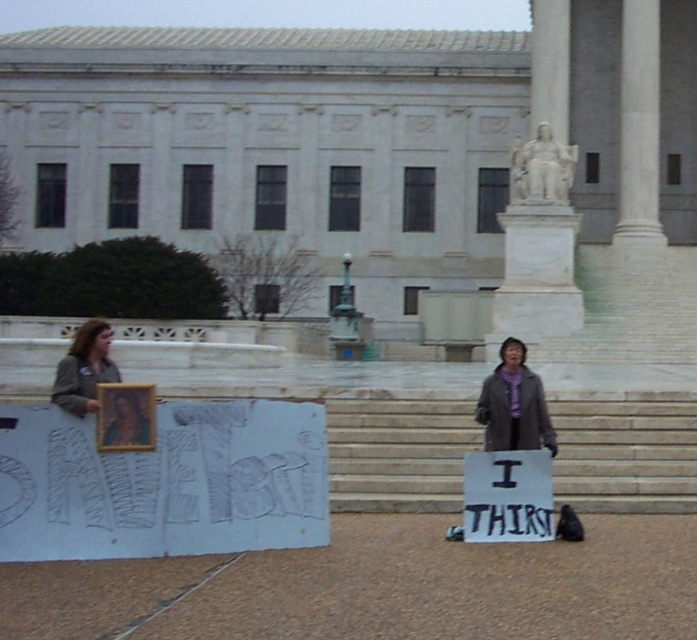
Locate an element on the screen. This screenshot has width=697, height=640. white stone stairs at center is located at coordinates (398, 452).

Does point (615, 490) come closer to viewer compared to point (102, 445)?

No, it is not.

Between point (560, 461) and point (99, 387), which one is positioned in front?

Positioned in front is point (99, 387).

Where is `white stone stairs at center`? This screenshot has height=640, width=697. white stone stairs at center is located at coordinates (398, 452).

Which is more to the left, white paper sign at center or matte wooden frame at center?

Positioned to the left is matte wooden frame at center.

Between point (537, 497) and point (151, 412), which one is positioned behind?

The point (537, 497) is more distant.

Between point (520, 522) and point (144, 417), which one is positioned behind?

The point (520, 522) is more distant.

Where is `white paper sign at center`? The height and width of the screenshot is (640, 697). white paper sign at center is located at coordinates (507, 497).

How distant is white marble column at center from matte wooden frame at center?

The distance of white marble column at center from matte wooden frame at center is 46.79 meters.

Who is higher up, white marble column at center or matte wooden frame at center?

white marble column at center is above.

At what (x,y) coordinates should I click in order to perform the action: click on white marble column at center. Please return your answer as a coordinate pair (x, y). Looking at the image, I should click on (638, 125).

I want to click on white marble column at center, so click(x=638, y=125).